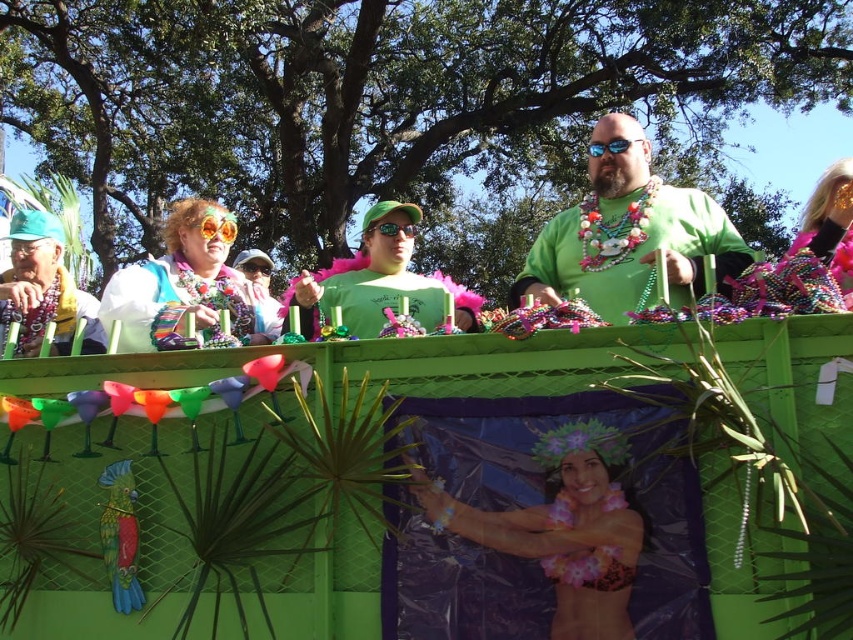
Which is in front, point (532, 291) or point (422, 284)?

Point (532, 291) is in front.

Is green matte shirt at center thinner than green feather boa at center?

No, green matte shirt at center is not thinner than green feather boa at center.

In the scene shown: Who is more distant from viewer, (587, 241) or (463, 301)?

The point (463, 301) is more distant.

I want to click on green matte shirt at center, so click(627, 234).

Who is higher up, white fabric with colorful beads at left or matte green shirt at left?

matte green shirt at left is above.

Where is `white fabric with colorful beads at left`? Image resolution: width=853 pixels, height=640 pixels. white fabric with colorful beads at left is located at coordinates (183, 300).

This screenshot has height=640, width=853. I want to click on white fabric with colorful beads at left, so click(183, 300).

Which is behind, point (469, 305) or point (90, 301)?

The point (90, 301) is more distant.

Is green feather boa at center above matte green shirt at left?

Yes, green feather boa at center is above matte green shirt at left.

Which is in front, point (320, 275) or point (82, 292)?

Point (320, 275) is more forward.

The height and width of the screenshot is (640, 853). Identify the location of green feather boa at center. (379, 280).